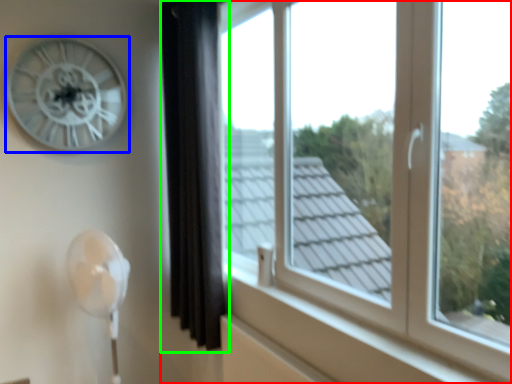
Question: Estimate the real-world distances between objects in this image. Which object is closer to window (highlighted by a red box), wall clock (highlighted by a blue box) or curtain (highlighted by a green box)?

Choices:
 (A) wall clock
 (B) curtain

Answer: (B)